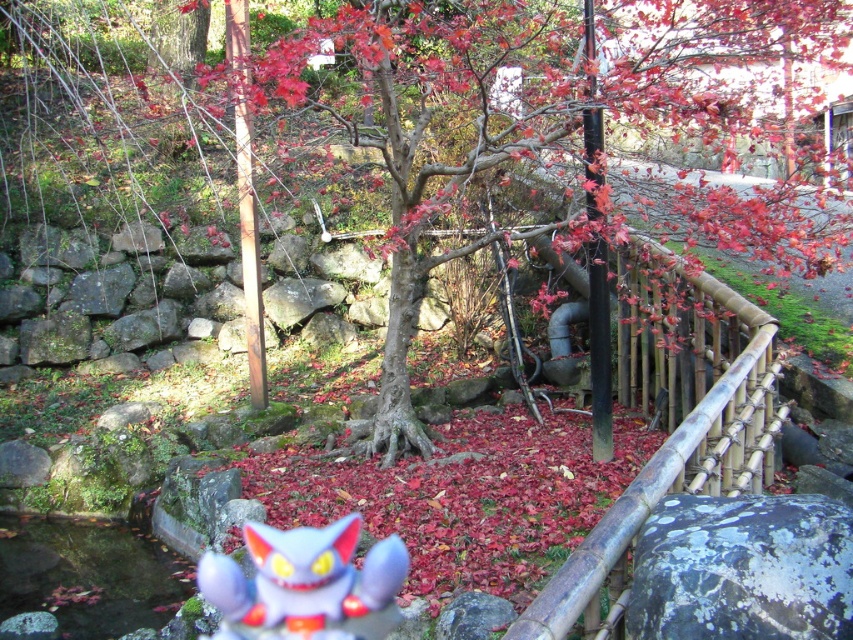
Question: Which point appears farthest from the camera in this image?

Choices:
 (A) (376, 611)
 (B) (500, 163)
 (C) (641, 484)

Answer: (B)

Question: Which point appears closest to the camera in this image?

Choices:
 (A) (200, 8)
 (B) (526, 612)
 (C) (387, 602)

Answer: (B)

Question: Does smooth bark tree at center appear over clear water at creek center?

Choices:
 (A) yes
 (B) no

Answer: (A)

Question: Is smooth bark tree at center wider than speckled gray rock at center?

Choices:
 (A) no
 (B) yes

Answer: (B)

Question: Which of the following is the closest to the observer?

Choices:
 (A) plush purple cat at center
 (B) clear water at creek center
 (C) speckled gray rock at center
 (D) bamboo fence at upper right

Answer: (C)

Question: Does bamboo fence at upper right appear over speckled gray rock at center?

Choices:
 (A) yes
 (B) no

Answer: (A)